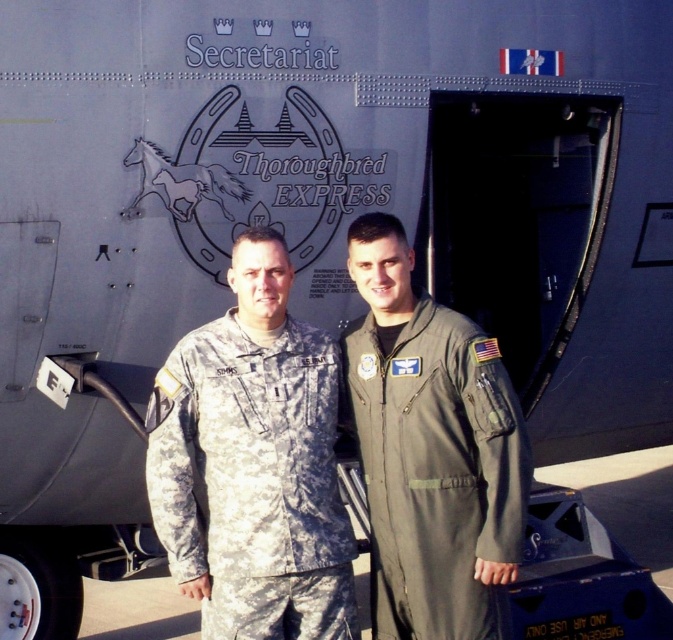
You are a photographer trying to capture the emblem on the aircraft. You notice a point marked at coordinates (252, 481). Based on the scene description, what object is located at this point?

The point at coordinates (252, 481) marks the camouflage fabric uniform at center.

You are a photographer trying to capture both the camouflage fabric uniform at center and the olive green fabric flight suit at center in a single frame. Given their sizes, which one should you focus on to ensure both are visible without cropping?

Since the camouflage fabric uniform at center is larger in size than the olive green fabric flight suit at center, you should focus on the camouflage fabric uniform at center to ensure both are visible without cropping.

You are standing in front of the aircraft and want to move from the point at coordinates point [289,474] to the point at coordinates point [378,344]. Which direction should you move?

You should move backward because point [289,474] is in front of point [378,344], so moving backward will take you towards point [378,344].